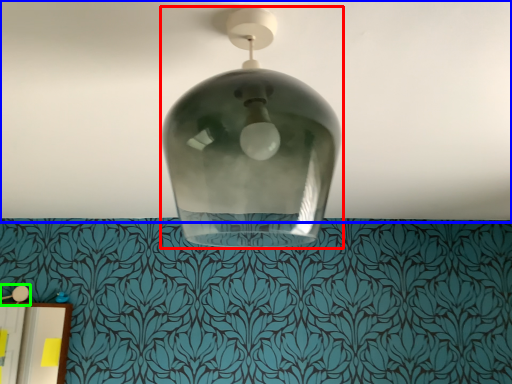
Question: Based on their relative distances, which object is farther from lamp (highlighted by a red box)? Choose from atmosphere (highlighted by a blue box) and lamp (highlighted by a green box).

Choices:
 (A) atmosphere
 (B) lamp

Answer: (B)